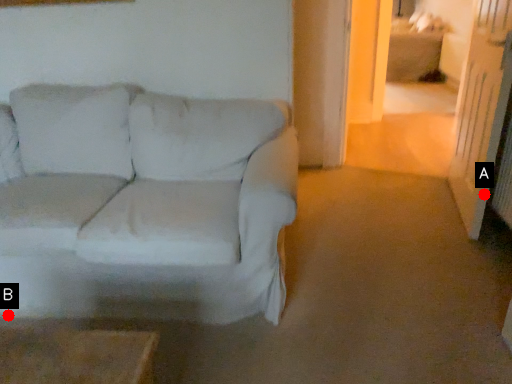
Question: Two points are circled on the image, labeled by A and B beside each circle. Among these points, which one is farthest from the camera?

Choices:
 (A) A is further
 (B) B is further

Answer: (A)